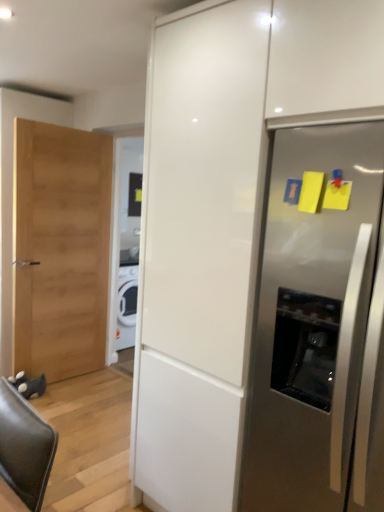
Question: Based on their positions, is stainless steel refrigerator at right located to the left or right of white glossy cabinet at center?

Choices:
 (A) left
 (B) right

Answer: (B)

Question: In the image, is stainless steel refrigerator at right positioned in front of or behind white glossy cabinet at center?

Choices:
 (A) front
 (B) behind

Answer: (B)

Question: In terms of size, does stainless steel refrigerator at right appear bigger or smaller than white glossy cabinet at center?

Choices:
 (A) small
 (B) big

Answer: (A)

Question: Relative to stainless steel refrigerator at right, is white glossy cabinet at center in front or behind?

Choices:
 (A) front
 (B) behind

Answer: (A)

Question: Is white glossy cabinet at center bigger or smaller than stainless steel refrigerator at right?

Choices:
 (A) small
 (B) big

Answer: (B)

Question: Is white glossy cabinet at center situated inside stainless steel refrigerator at right or outside?

Choices:
 (A) inside
 (B) outside

Answer: (A)

Question: Would you say white glossy cabinet at center is to the left or to the right of stainless steel refrigerator at right in the picture?

Choices:
 (A) left
 (B) right

Answer: (A)